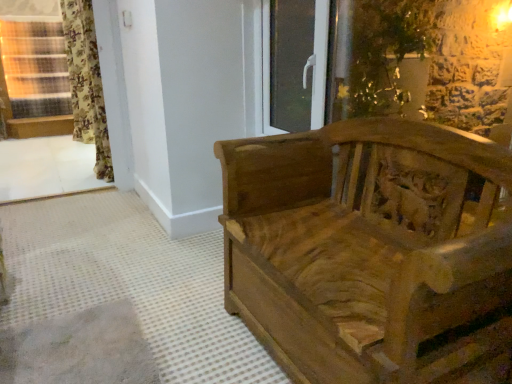
Question: Is transparent glass door at upper center shorter than wooden window frame at lower left?

Choices:
 (A) no
 (B) yes

Answer: (B)

Question: Is transparent glass door at upper center next to wooden window frame at lower left and touching it?

Choices:
 (A) yes
 (B) no

Answer: (B)

Question: Is transparent glass door at upper center looking in the opposite direction of wooden window frame at lower left?

Choices:
 (A) no
 (B) yes

Answer: (A)

Question: From the image's perspective, is transparent glass door at upper center below wooden window frame at lower left?

Choices:
 (A) yes
 (B) no

Answer: (B)

Question: Considering the relative sizes of transparent glass door at upper center and wooden window frame at lower left in the image provided, is transparent glass door at upper center smaller than wooden window frame at lower left?

Choices:
 (A) no
 (B) yes

Answer: (B)

Question: Looking at their shapes, would you say transparent glass door at upper center is wider or thinner than wooden window frame at lower left?

Choices:
 (A) thin
 (B) wide

Answer: (A)

Question: Considering the positions of transparent glass door at upper center and wooden window frame at lower left in the image, is transparent glass door at upper center bigger or smaller than wooden window frame at lower left?

Choices:
 (A) small
 (B) big

Answer: (A)

Question: In terms of height, does transparent glass door at upper center look taller or shorter compared to wooden window frame at lower left?

Choices:
 (A) tall
 (B) short

Answer: (B)

Question: Would you say transparent glass door at upper center is to the left or to the right of wooden window frame at lower left in the picture?

Choices:
 (A) right
 (B) left

Answer: (A)

Question: From a real-world perspective, is transparent glass door at upper center positioned above or below floral fabric curtain at left?

Choices:
 (A) below
 (B) above

Answer: (B)

Question: Looking at their shapes, would you say transparent glass door at upper center is wider or thinner than floral fabric curtain at left?

Choices:
 (A) thin
 (B) wide

Answer: (A)

Question: Is transparent glass door at upper center inside or outside of floral fabric curtain at left?

Choices:
 (A) outside
 (B) inside

Answer: (A)

Question: Based on their positions, is transparent glass door at upper center located to the left or right of floral fabric curtain at left?

Choices:
 (A) left
 (B) right

Answer: (B)

Question: Considering the positions of point (306, 251) and point (266, 11), is point (306, 251) closer or farther from the camera than point (266, 11)?

Choices:
 (A) farther
 (B) closer

Answer: (B)

Question: Looking at the image, does wooden carved bench at right seem bigger or smaller compared to transparent glass door at upper center?

Choices:
 (A) big
 (B) small

Answer: (A)